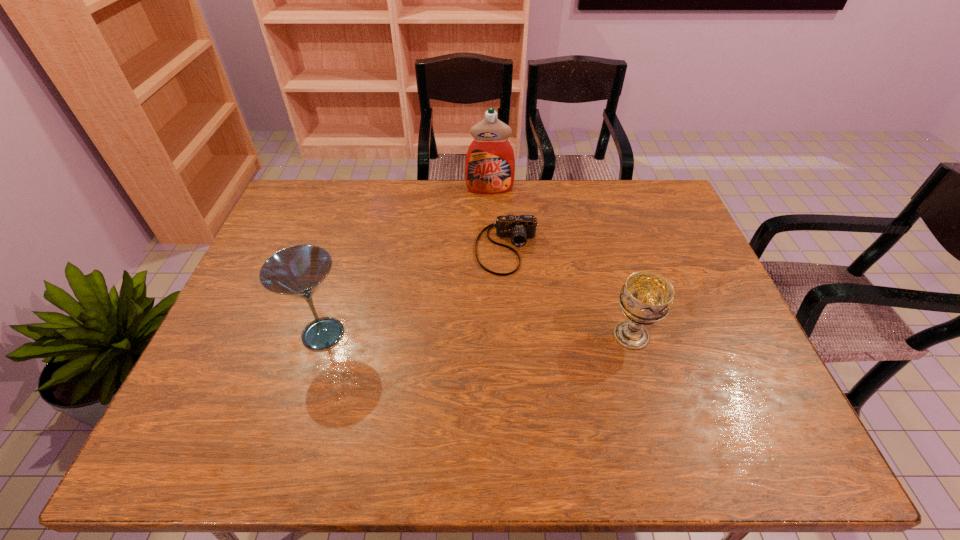
Find the location of a particular element. The image size is (960, 540). free space on the desktop that is between the leftmost object and the rightmost object and is positioned on the front surface of the detergent is located at coordinates (498, 335).

At what (x,y) coordinates should I click in order to perform the action: click on vacant space on the desktop that is between the leftmost object and the third tallest object and is positioned on the front-facing side of the shortest object. Please return your answer as a coordinate pair (x, y). Image resolution: width=960 pixels, height=540 pixels. Looking at the image, I should click on (506, 335).